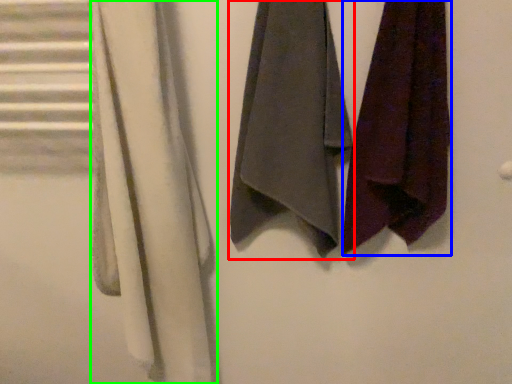
Question: Which is nearer to the towel (highlighted by a red box)? towel (highlighted by a blue box) or cloth (highlighted by a green box).

Choices:
 (A) towel
 (B) cloth

Answer: (A)